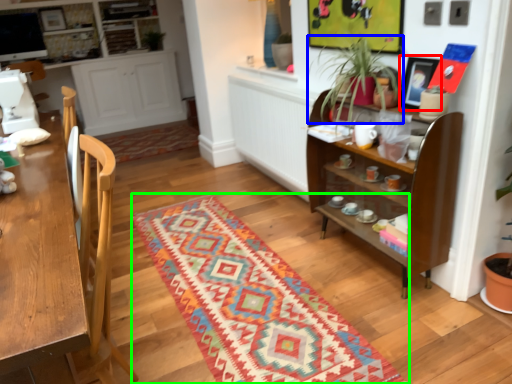
Question: Considering the real-world distances, which object is closest to picture frame (highlighted by a red box)? houseplant (highlighted by a blue box) or mat (highlighted by a green box).

Choices:
 (A) houseplant
 (B) mat

Answer: (A)